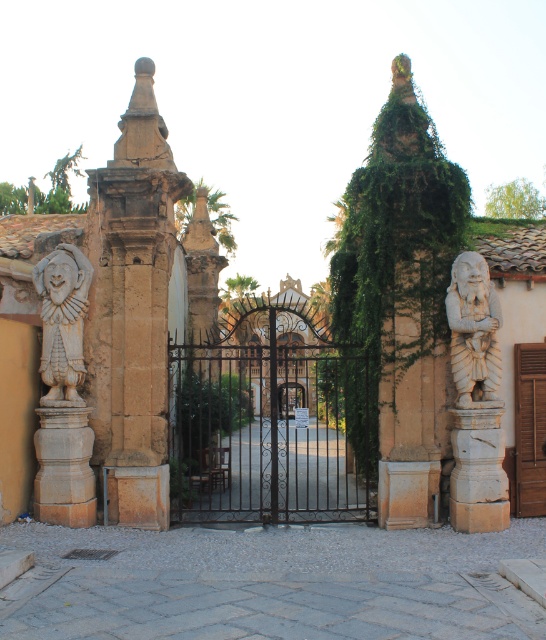
Question: Which object is farther from the camera taking this photo?

Choices:
 (A) brown wooden door at right
 (B) white stone dwarf at right
 (C) stone clown at left

Answer: (A)

Question: Which of these objects is positioned closest to the white stone dwarf at right?

Choices:
 (A) brown wooden door at right
 (B) stone clown at left

Answer: (A)

Question: In this image, where is white stone dwarf at right located relative to brown wooden door at right?

Choices:
 (A) right
 (B) left

Answer: (B)

Question: Can you confirm if stone clown at left is positioned to the left of white stone dwarf at right?

Choices:
 (A) no
 (B) yes

Answer: (B)

Question: Estimate the real-world distances between objects in this image. Which object is closer to the stone clown at left?

Choices:
 (A) white stone dwarf at right
 (B) brown wooden door at right

Answer: (A)

Question: In this image, where is stone clown at left located relative to brown wooden door at right?

Choices:
 (A) below
 (B) above

Answer: (B)